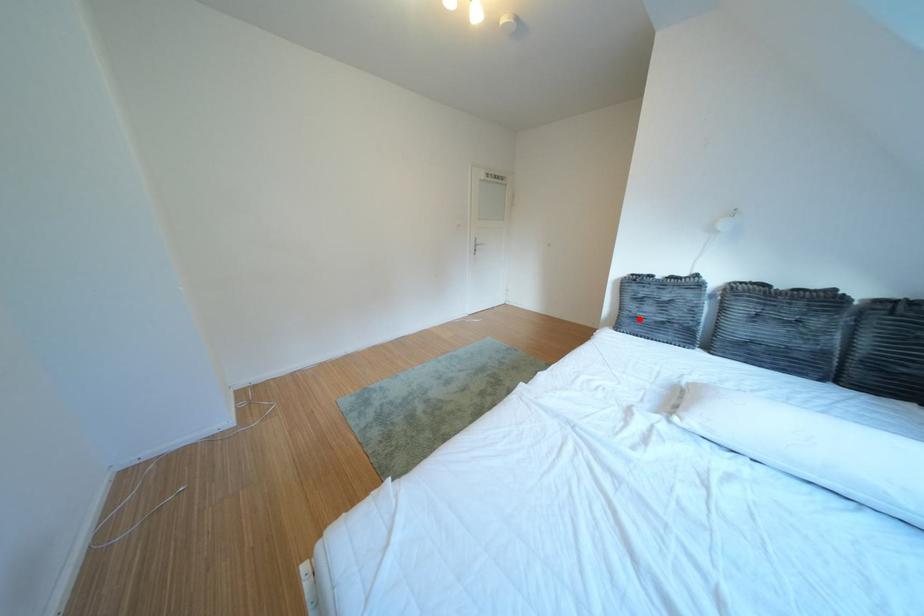
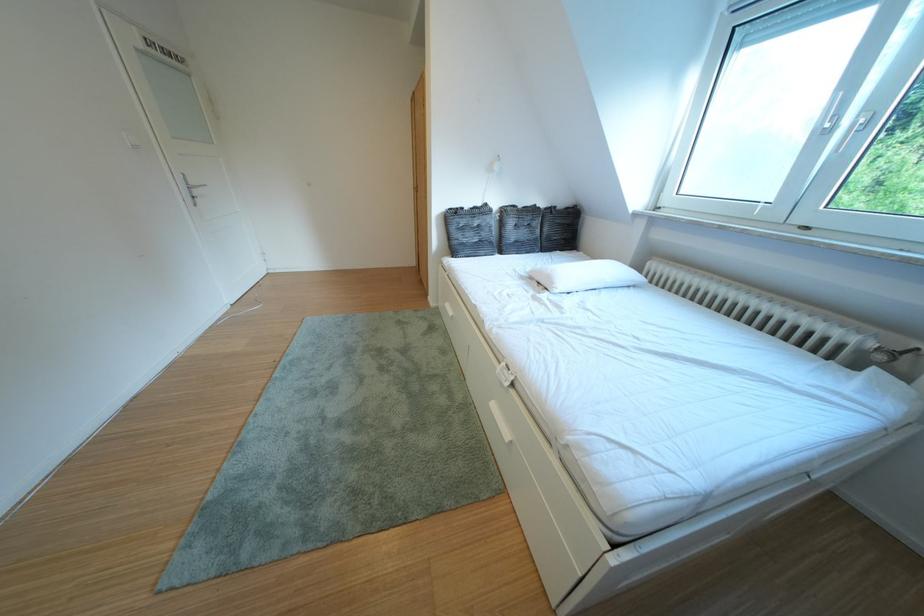
In the second image, find the point that corresponds to the highlighted location in the first image.

(468, 246)